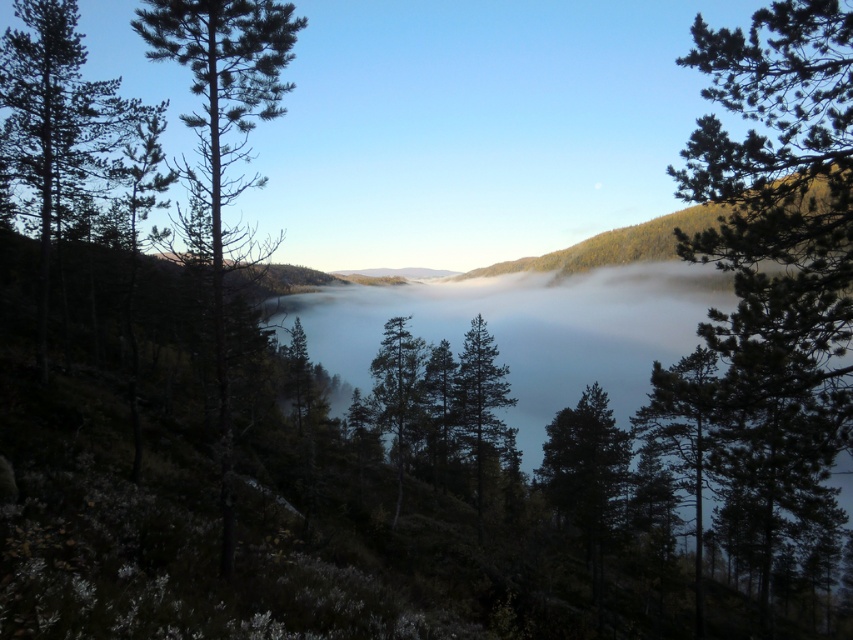
Can you confirm if green needle-like tree at left is positioned to the left of green matte tree at center?

Correct, you'll find green needle-like tree at left to the left of green matte tree at center.

From the picture: Is green needle-like tree at left closer to the viewer compared to green matte tree at center?

Yes, green needle-like tree at left is closer to the viewer.

Image resolution: width=853 pixels, height=640 pixels. What do you see at coordinates (222, 148) in the screenshot?
I see `green needle-like tree at left` at bounding box center [222, 148].

At what (x,y) coordinates should I click in order to perform the action: click on green needle-like tree at left. Please return your answer as a coordinate pair (x, y). This screenshot has height=640, width=853. Looking at the image, I should click on (222, 148).

Between green needle-like tree at right and green needle-like tree at left, which one is positioned lower?

green needle-like tree at right

Is the position of green needle-like tree at right less distant than that of green needle-like tree at left?

Yes, it is.

Describe the element at coordinates (780, 211) in the screenshot. I see `green needle-like tree at right` at that location.

Where is `green needle-like tree at right`? Image resolution: width=853 pixels, height=640 pixels. green needle-like tree at right is located at coordinates (780, 211).

Can you confirm if green needle-like tree at right is positioned to the right of green matte tree at center?

Indeed, green needle-like tree at right is positioned on the right side of green matte tree at center.

Does green needle-like tree at right have a lesser height compared to green matte tree at center?

In fact, green needle-like tree at right may be taller than green matte tree at center.

Does point (759, 246) lie behind point (485, 436)?

No.

Locate an element on the screen. green needle-like tree at right is located at coordinates pos(780,211).